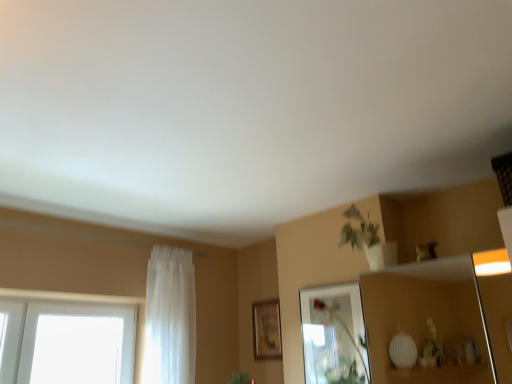
Question: Are wooden picture frame at center and white sheer curtain at left beside each other?

Choices:
 (A) no
 (B) yes

Answer: (A)

Question: Is wooden picture frame at center oriented away from white sheer curtain at left?

Choices:
 (A) no
 (B) yes

Answer: (A)

Question: Is there a large distance between wooden picture frame at center and white sheer curtain at left?

Choices:
 (A) no
 (B) yes

Answer: (A)

Question: Is wooden picture frame at center closer to camera compared to white sheer curtain at left?

Choices:
 (A) yes
 (B) no

Answer: (B)

Question: From the image's perspective, is wooden picture frame at center located beneath white sheer curtain at left?

Choices:
 (A) yes
 (B) no

Answer: (A)

Question: Is white sheer curtain at left completely or partially inside wooden picture frame at center?

Choices:
 (A) yes
 (B) no

Answer: (B)

Question: Can you confirm if white sheer curtain at left is shorter than clear glass mirror at upper center?

Choices:
 (A) yes
 (B) no

Answer: (B)

Question: Is white sheer curtain at left completely or partially outside of clear glass mirror at upper center?

Choices:
 (A) no
 (B) yes

Answer: (B)

Question: From the image's perspective, does white sheer curtain at left appear lower than clear glass mirror at upper center?

Choices:
 (A) yes
 (B) no

Answer: (B)

Question: Is white sheer curtain at left next to clear glass mirror at upper center?

Choices:
 (A) no
 (B) yes

Answer: (A)

Question: Is white sheer curtain at left looking in the opposite direction of clear glass mirror at upper center?

Choices:
 (A) yes
 (B) no

Answer: (B)

Question: Is white sheer curtain at left smaller than clear glass mirror at upper center?

Choices:
 (A) no
 (B) yes

Answer: (A)

Question: From the image's perspective, is white sheer curtain at left beneath wooden picture frame at center?

Choices:
 (A) yes
 (B) no

Answer: (B)